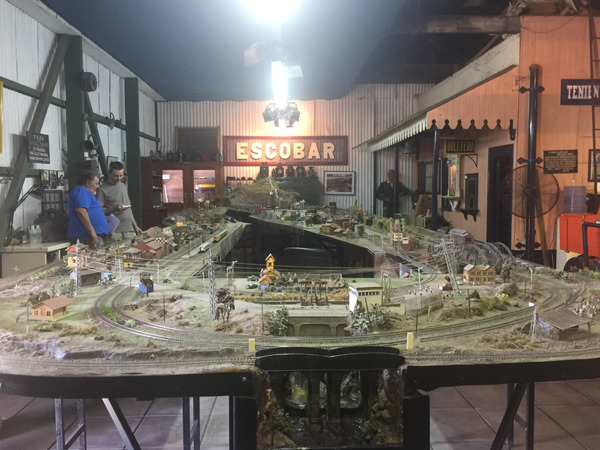
The image size is (600, 450). What are the coordinates of `door` in the screenshot? It's located at (502, 199).